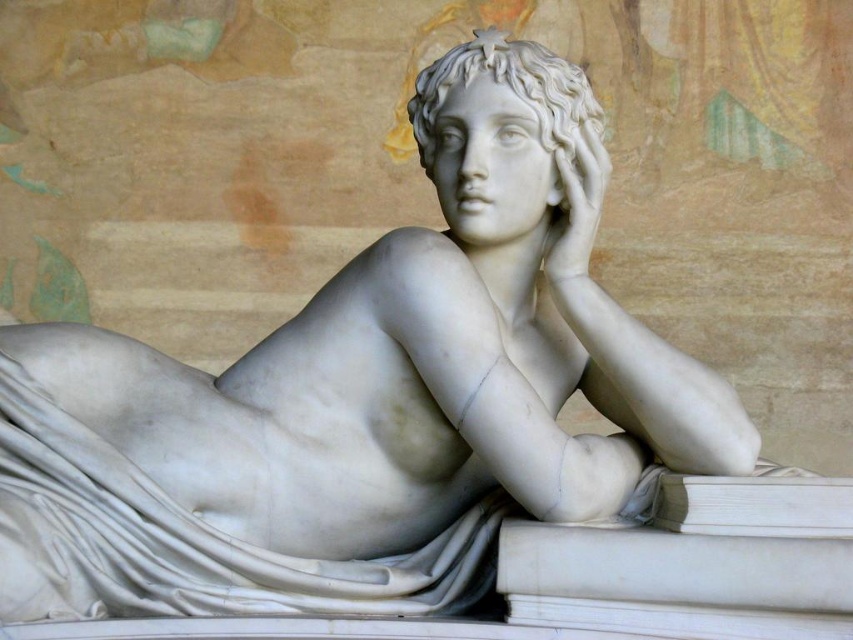
What are the coordinates of the white marble head at center?

The white marble head at center is located at point (509, 90).

You are an art student analyzing the classical marble sculpture. You notice a specific point marked at coordinates (509, 90). Which part of the sculpture does this point most likely correspond to?

The point at (509, 90) corresponds to the white marble head at center.

You are an art conservator examining the classical marble sculpture. You notice the white marble head at center and the white marble hand at upper center. From your viewpoint, which object is closer to you?

The white marble head at center is closer to you because it is positioned in front of the white marble hand at upper center.